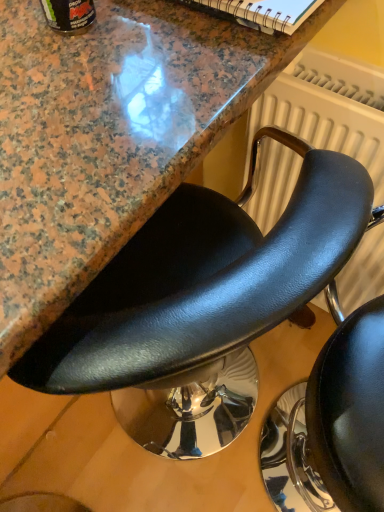
Question: Should I look upward or downward to see black leather chair at center, arranged as the first chair when viewed from the left?

Choices:
 (A) down
 (B) up

Answer: (A)

Question: Is white textured radiator at upper right behind black leather chair at center, marked as the 2th chair in a left-to-right arrangement?

Choices:
 (A) yes
 (B) no

Answer: (A)

Question: From a real-world perspective, does white textured radiator at upper right sit lower than black leather chair at center, marked as the 2th chair in a left-to-right arrangement?

Choices:
 (A) no
 (B) yes

Answer: (A)

Question: Is white textured radiator at upper right closer to camera compared to black leather chair at center, marked as the 2th chair in a left-to-right arrangement?

Choices:
 (A) yes
 (B) no

Answer: (B)

Question: Is white textured radiator at upper right taller than black leather chair at center, the 1th chair viewed from the right?

Choices:
 (A) no
 (B) yes

Answer: (A)

Question: Is white textured radiator at upper right positioned far away from black leather chair at center, marked as the 2th chair in a left-to-right arrangement?

Choices:
 (A) yes
 (B) no

Answer: (B)

Question: From the image's perspective, is white textured radiator at upper right located above black leather chair at center, marked as the 2th chair in a left-to-right arrangement?

Choices:
 (A) yes
 (B) no

Answer: (A)

Question: Is black leather chair at center, marked as the 2th chair in a left-to-right arrangement, to the right of black leather chair at center, the second chair positioned from the right, from the viewer's perspective?

Choices:
 (A) no
 (B) yes

Answer: (B)

Question: From the image's perspective, is black leather chair at center, the 1th chair viewed from the right, over black leather chair at center, the second chair positioned from the right?

Choices:
 (A) yes
 (B) no

Answer: (B)

Question: Is black leather chair at center, the 1th chair viewed from the right, not near black leather chair at center, arranged as the first chair when viewed from the left?

Choices:
 (A) no
 (B) yes

Answer: (A)

Question: From a real-world perspective, does black leather chair at center, the 1th chair viewed from the right, sit lower than black leather chair at center, the second chair positioned from the right?

Choices:
 (A) yes
 (B) no

Answer: (B)

Question: Is black leather chair at center, the 1th chair viewed from the right, shorter than black leather chair at center, arranged as the first chair when viewed from the left?

Choices:
 (A) yes
 (B) no

Answer: (B)

Question: Is black leather chair at center, marked as the 2th chair in a left-to-right arrangement, looking in the opposite direction of black leather chair at center, arranged as the first chair when viewed from the left?

Choices:
 (A) yes
 (B) no

Answer: (A)

Question: Can you confirm if black leather chair at center, marked as the 2th chair in a left-to-right arrangement, is smaller than white textured radiator at upper right?

Choices:
 (A) yes
 (B) no

Answer: (B)